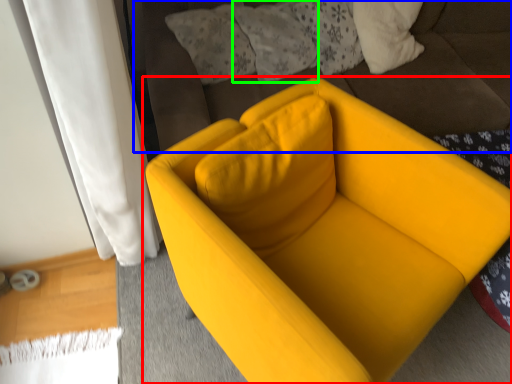
Question: Considering the real-world distances, which object is farthest from chair (highlighted by a red box)? bedding (highlighted by a blue box) or pillow (highlighted by a green box)?

Choices:
 (A) bedding
 (B) pillow

Answer: (B)